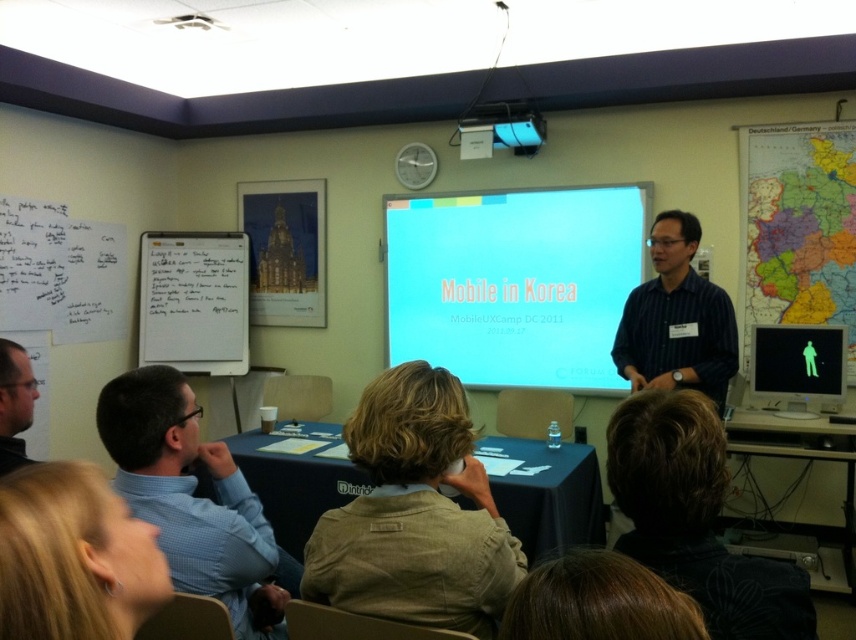
You are attending a presentation in a conference room and notice two shirts at the lower left corner of the room. Which shirt is closer to you, the blue checkered shirt at lower left or the matte black shirt at lower left?

The blue checkered shirt at lower left is closer to you as it is positioned in front of the matte black shirt at lower left.

You are an attendee at the MobileUXCamp DC 2011 presentation. You notice the blue checkered shirt at lower left and the whiteboard at left. Which object is wider?

The whiteboard at left is wider than the blue checkered shirt at lower left because the blue checkered shirt at lower left has a smaller width compared to the whiteboard at left.